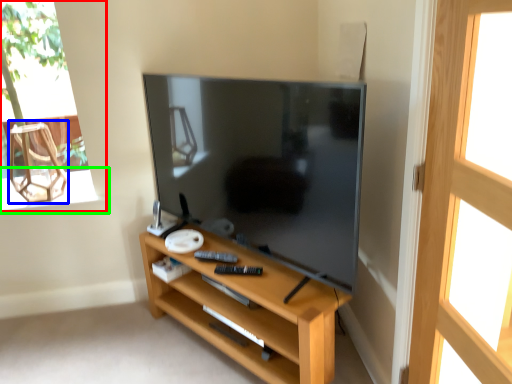
Question: Based on their relative distances, which object is nearer to window (highlighted by a red box)? Choose from armchair (highlighted by a blue box) and window sill (highlighted by a green box).

Choices:
 (A) armchair
 (B) window sill

Answer: (A)